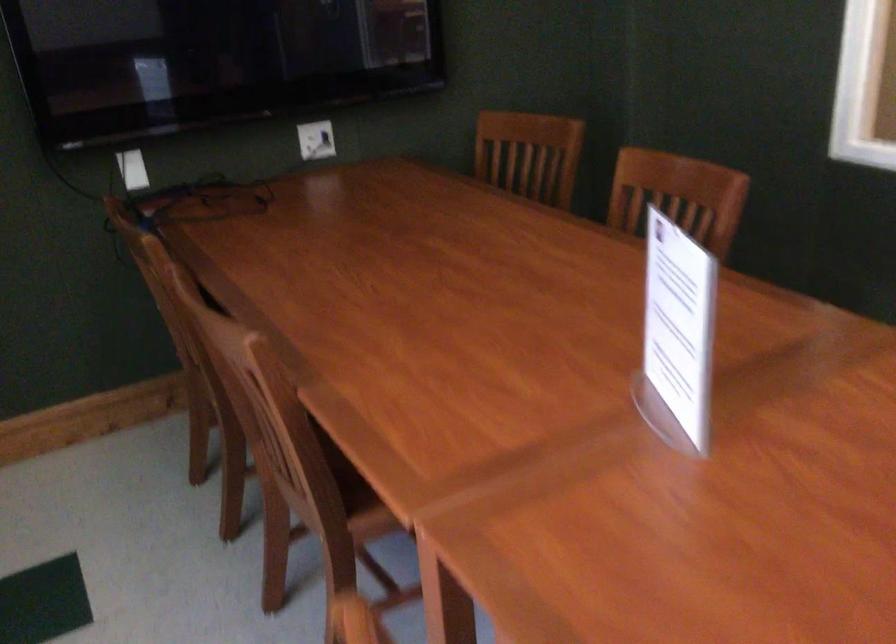
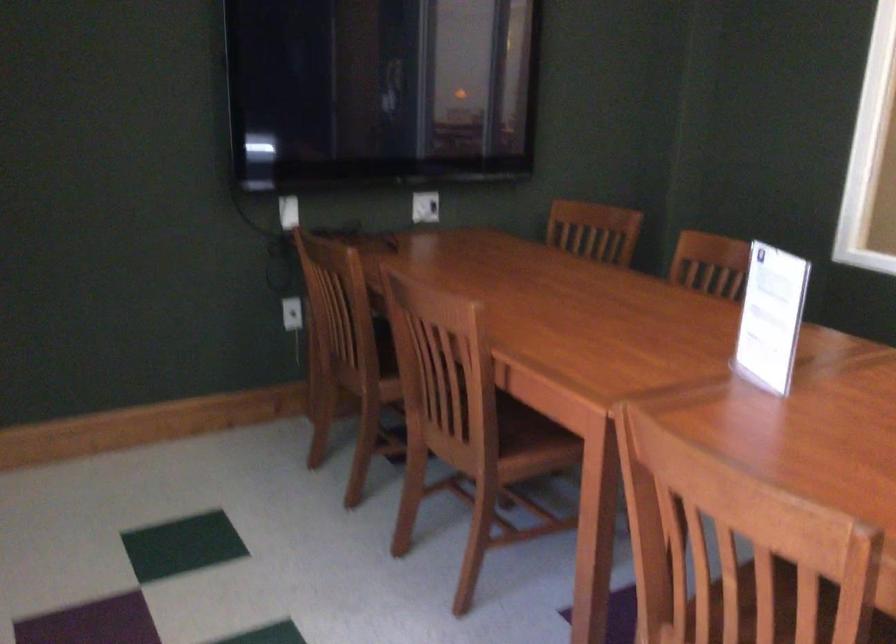
The images are taken continuously from a first-person perspective. In which direction are you moving?

The cameraman moved toward left, backward.